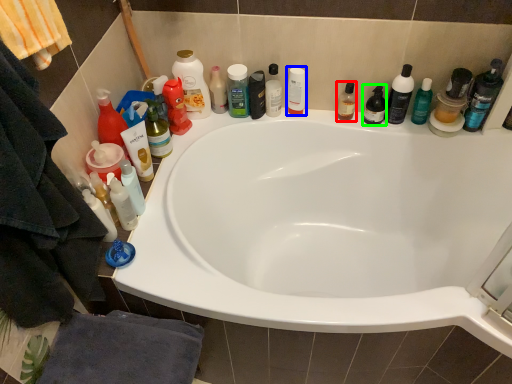
Question: Which object is the farthest from mouthwash (highlighted by a red box)? Choose among these: mouthwash (highlighted by a blue box) or toiletry (highlighted by a green box).

Choices:
 (A) mouthwash
 (B) toiletry

Answer: (A)